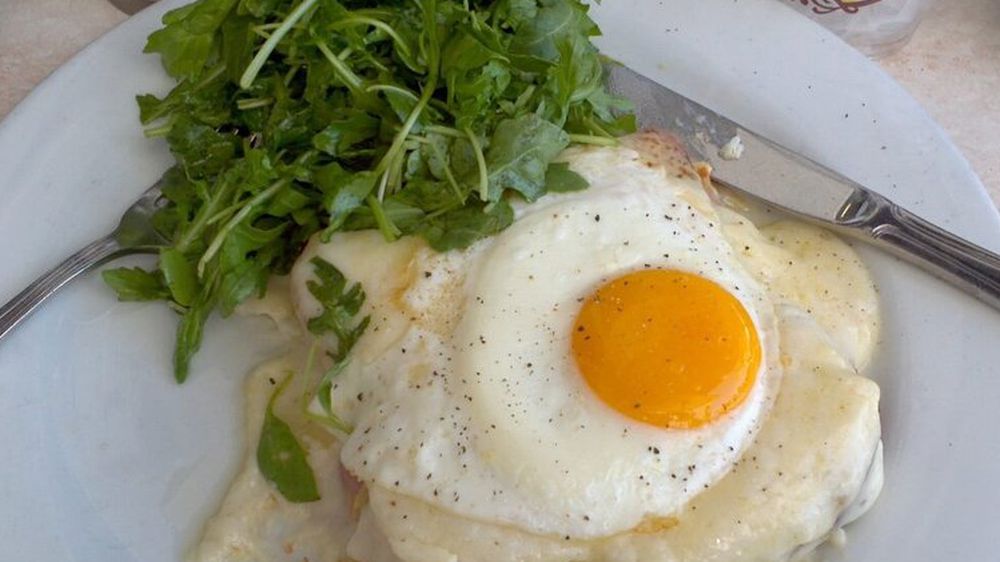
The width and height of the screenshot is (1000, 562). Identify the location of silver butterknife. pos(835,194).